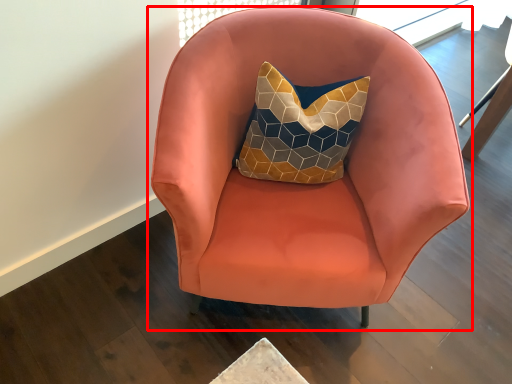
Question: From the image's perspective, considering the relative positions of chair (annotated by the red box) and swivel chair in the image provided, where is chair (annotated by the red box) located with respect to the staircase?

Choices:
 (A) below
 (B) above

Answer: (A)